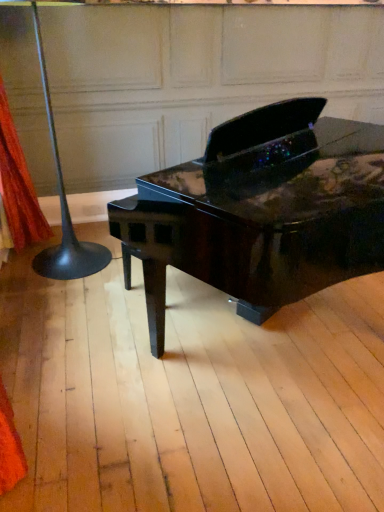
Where is `vacant area that is in front of black glossy floor lamp at left`? vacant area that is in front of black glossy floor lamp at left is located at coordinates (78, 300).